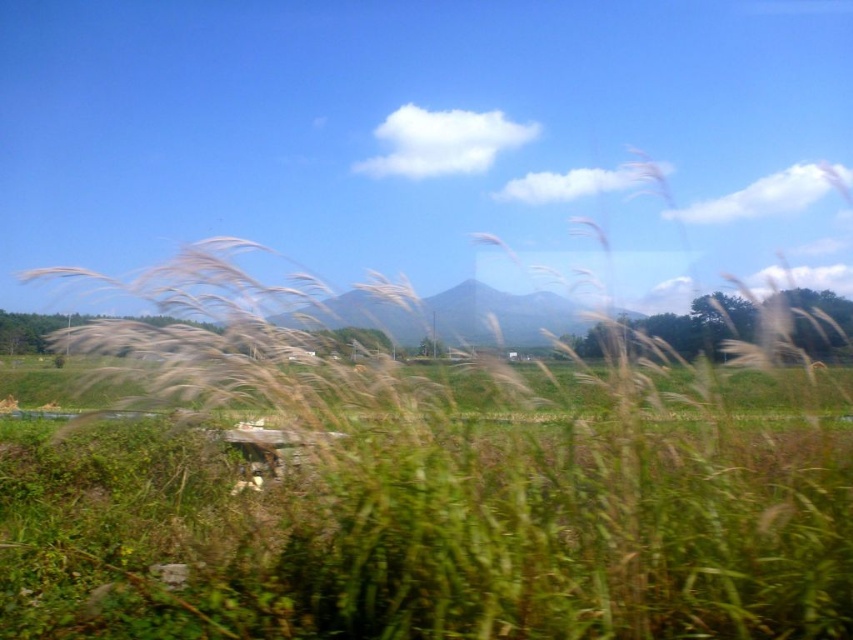
You are standing in the rural landscape and want to take a photo of the white fluffy grass at center and the green matte mountain at center. Which object should you focus on first if you want both to be in sharp focus?

You should focus on the green matte mountain at center first because it is farther away than the white fluffy grass at center, ensuring both will be in focus when using a small aperture or adjusting the focal point appropriately.

You are standing in the rural landscape and want to determine the relative positions of two points. Which point is closer to you, point (x=149, y=557) or point (x=560, y=307)?

Point (x=149, y=557) is closer to the camera than point (x=560, y=307).

You are a photographer trying to capture the white fluffy grass at center and the green matte mountain at center in the same frame. Based on their sizes, which object should you focus on first to ensure both fit in the shot?

The white fluffy grass at center has a larger size compared to the green matte mountain at center, so you should focus on the white fluffy grass at center first to ensure both fit in the shot.